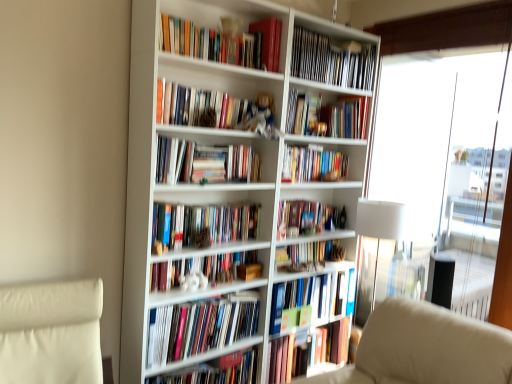
Question: Can you confirm if hardcover books at center, acting as the eleventh book starting from the top, is positioned to the left of hardcover books at upper center, which is the fourth book in top-to-bottom order?

Choices:
 (A) no
 (B) yes

Answer: (B)

Question: Can you confirm if hardcover books at center, placed as the 3th book when sorted from bottom to top, is shorter than hardcover books at upper center, which is the fourth book in top-to-bottom order?

Choices:
 (A) yes
 (B) no

Answer: (B)

Question: Can we say hardcover books at center, placed as the 3th book when sorted from bottom to top, lies outside hardcover books at upper center, which is the 10th book from bottom to top?

Choices:
 (A) yes
 (B) no

Answer: (A)

Question: Is hardcover books at center, placed as the 3th book when sorted from bottom to top, in contact with hardcover books at upper center, which is the 10th book from bottom to top?

Choices:
 (A) yes
 (B) no

Answer: (B)

Question: From a real-world perspective, is hardcover books at center, placed as the 3th book when sorted from bottom to top, on top of hardcover books at upper center, which is the fourth book in top-to-bottom order?

Choices:
 (A) yes
 (B) no

Answer: (B)

Question: Is hardcover books at upper center, which is the 10th book from bottom to top, at the back of hardcover books at center, placed as the 3th book when sorted from bottom to top?

Choices:
 (A) yes
 (B) no

Answer: (B)

Question: Does green matte book at center, placed as the tenth book when sorted from top to bottom, appear on the left side of hardcover book at center, the 1th book from the bottom?

Choices:
 (A) no
 (B) yes

Answer: (A)

Question: Is green matte book at center, the 4th book ordered from the bottom, far away from hardcover book at center, the 1th book from the bottom?

Choices:
 (A) yes
 (B) no

Answer: (B)

Question: From the image's perspective, is green matte book at center, the 4th book ordered from the bottom, below hardcover book at center, which is the 13th book from top to bottom?

Choices:
 (A) yes
 (B) no

Answer: (B)

Question: From a real-world perspective, is green matte book at center, the 4th book ordered from the bottom, under hardcover book at center, the 1th book from the bottom?

Choices:
 (A) yes
 (B) no

Answer: (B)

Question: Can you confirm if green matte book at center, placed as the tenth book when sorted from top to bottom, is thinner than hardcover book at center, the 1th book from the bottom?

Choices:
 (A) yes
 (B) no

Answer: (A)

Question: Is green matte book at center, placed as the tenth book when sorted from top to bottom, positioned beyond the bounds of hardcover book at center, the 1th book from the bottom?

Choices:
 (A) no
 (B) yes

Answer: (B)

Question: Can you confirm if hardcover books at upper center, arranged as the 13th book when ordered from the bottom, is shorter than shiny gold ornament at upper center, marked as the 11th book in a bottom-to-top arrangement?

Choices:
 (A) no
 (B) yes

Answer: (A)